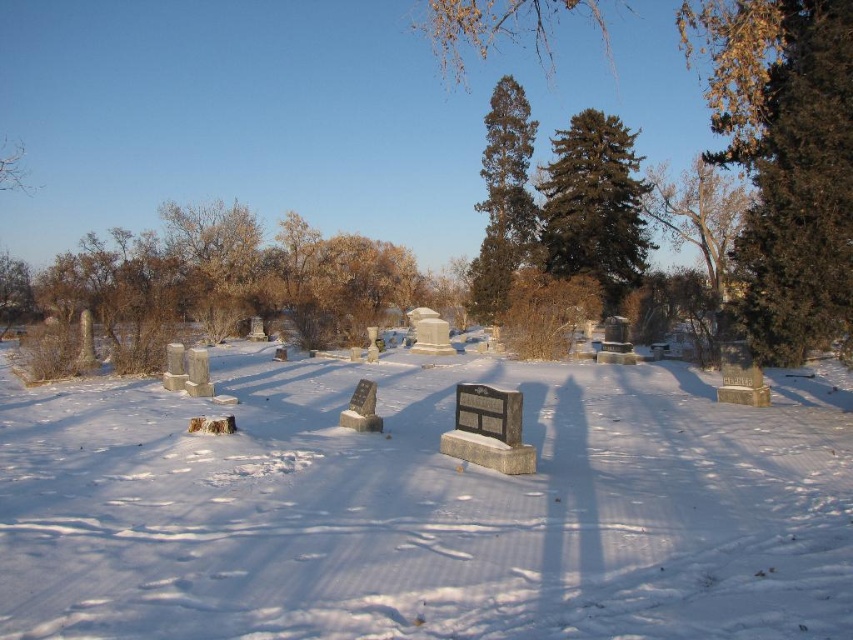
Can you confirm if white powdery snow at center is positioned to the right of dark green coniferous tree at center?

In fact, white powdery snow at center is to the left of dark green coniferous tree at center.

In order to click on white powdery snow at center in this screenshot , I will do `click(422, 508)`.

The height and width of the screenshot is (640, 853). In order to click on white powdery snow at center in this screenshot , I will do `click(422, 508)`.

Does white powdery snow at center appear under polished granite gravestone at center?

Yes.

Can you confirm if white powdery snow at center is positioned above polished granite gravestone at center?

No.

Find the location of a particular element. The image size is (853, 640). white powdery snow at center is located at coordinates (422, 508).

Does point (532, 568) come farther from viewer compared to point (474, 429)?

No.

Does point (685, 397) come in front of point (506, 444)?

That is False.

Where is `white powdery snow at center`? Image resolution: width=853 pixels, height=640 pixels. white powdery snow at center is located at coordinates (422, 508).